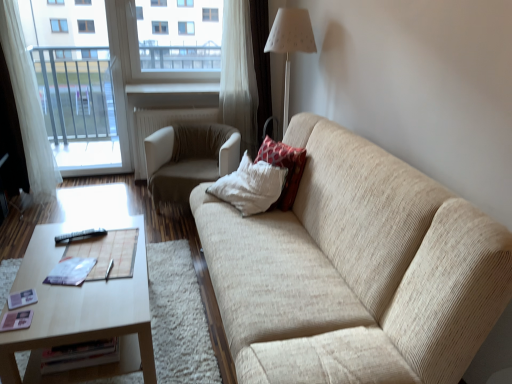
Question: From the image's perspective, is white sheer curtain at left below transparent glass window at upper center?

Choices:
 (A) yes
 (B) no

Answer: (A)

Question: Is white sheer curtain at left thinner than transparent glass window at upper center?

Choices:
 (A) no
 (B) yes

Answer: (B)

Question: Can you confirm if white sheer curtain at left is bigger than transparent glass window at upper center?

Choices:
 (A) no
 (B) yes

Answer: (A)

Question: From the image's perspective, is white sheer curtain at left located above transparent glass window at upper center?

Choices:
 (A) yes
 (B) no

Answer: (B)

Question: Does white sheer curtain at left have a greater height compared to transparent glass window at upper center?

Choices:
 (A) no
 (B) yes

Answer: (B)

Question: Considering the relative positions of white sheer curtain at left and transparent glass window at upper center in the image provided, is white sheer curtain at left to the right of transparent glass window at upper center from the viewer's perspective?

Choices:
 (A) no
 (B) yes

Answer: (A)

Question: Does beige fabric couch at center have a lesser width compared to red textured pillow at upper right?

Choices:
 (A) no
 (B) yes

Answer: (A)

Question: Does beige fabric couch at center appear on the right side of red textured pillow at upper right?

Choices:
 (A) yes
 (B) no

Answer: (A)

Question: Is beige fabric couch at center surrounding red textured pillow at upper right?

Choices:
 (A) yes
 (B) no

Answer: (A)

Question: Considering the relative sizes of beige fabric couch at center and red textured pillow at upper right in the image provided, is beige fabric couch at center shorter than red textured pillow at upper right?

Choices:
 (A) no
 (B) yes

Answer: (A)

Question: Considering the relative positions of beige fabric couch at center and red textured pillow at upper right in the image provided, is beige fabric couch at center in front of red textured pillow at upper right?

Choices:
 (A) no
 (B) yes

Answer: (B)

Question: Is beige fabric couch at center to the left of red textured pillow at upper right from the viewer's perspective?

Choices:
 (A) no
 (B) yes

Answer: (A)

Question: Is white fabric lampshade at upper center positioned far away from beige fabric chair at center?

Choices:
 (A) no
 (B) yes

Answer: (B)